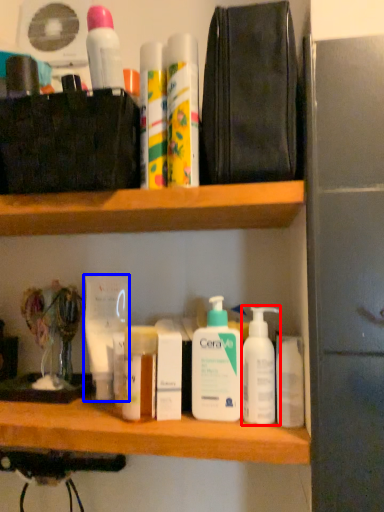
Question: Which of the following is the closest to the observer, cleaning product (highlighted by a red box) or mouthwash (highlighted by a blue box)?

Choices:
 (A) cleaning product
 (B) mouthwash

Answer: (A)